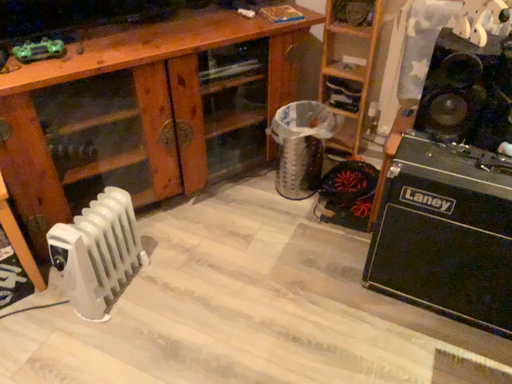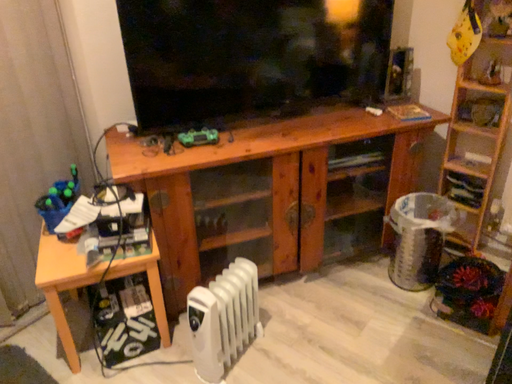
Question: How did the camera likely rotate when shooting the video?

Choices:
 (A) rotated right
 (B) rotated left

Answer: (B)